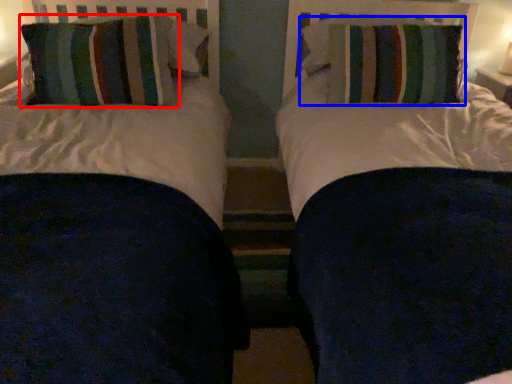
Question: Which object appears farthest to the camera in this image, pillow (highlighted by a red box) or pillow (highlighted by a blue box)?

Choices:
 (A) pillow
 (B) pillow

Answer: (B)